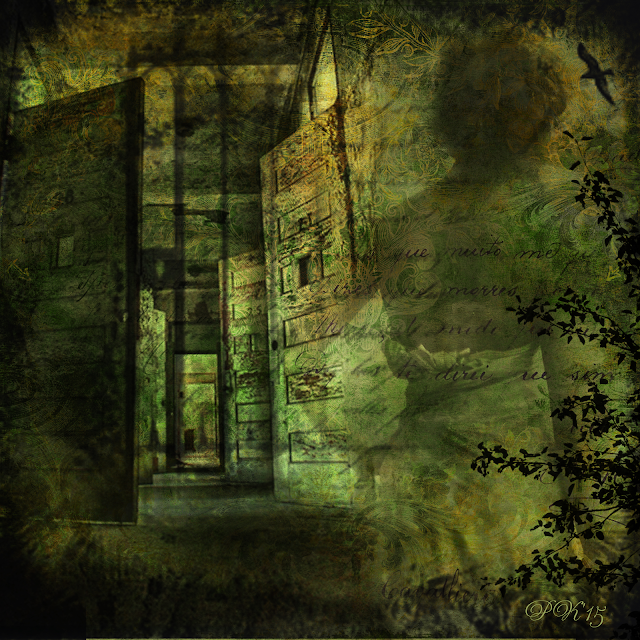
This screenshot has height=640, width=640. I want to click on open door, so click(x=45, y=358), click(x=248, y=406), click(x=152, y=404), click(x=205, y=406).